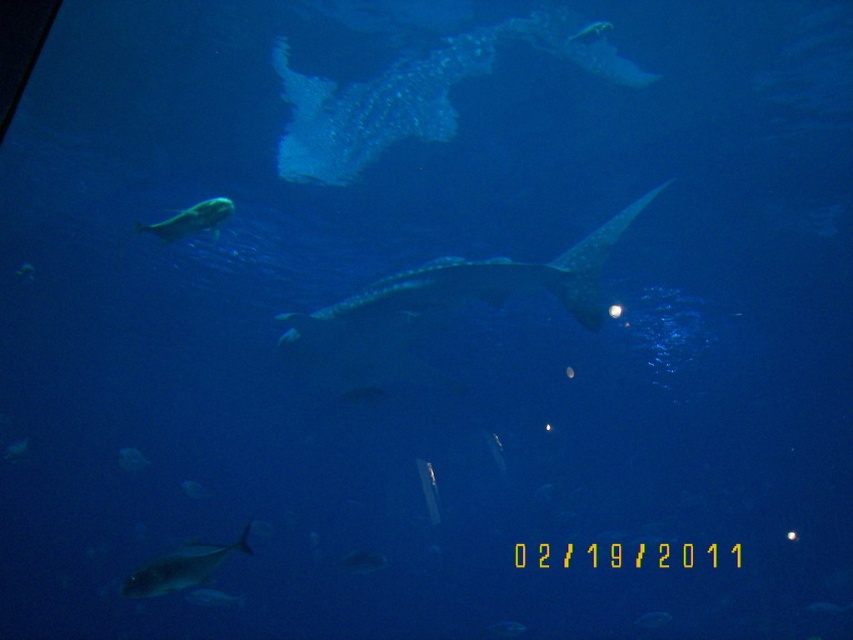
You are a marine biologist observing the underwater scene. You notice two shiny silver fish. Which one is nearer to you, the shiny silver fish at bottom left or the shiny silver fish at center?

The shiny silver fish at bottom left is closer to the viewer than the shiny silver fish at center.

You are a diver exploring the underwater scene. You notice two points marked in the image. The first point is at coordinate point (138, 593) and the second is at point (604, 20). Which point is closer to you as you face the scene?

Point (138, 593) is in front of point (604, 20), so it is closer to you as you face the scene.

From the picture: You are a marine biologist observing the underwater scene. You notice a point marked at coordinates (190, 220). What is the object located at this point?

The point at coordinates (190, 220) corresponds to the shiny silver fish at upper left.